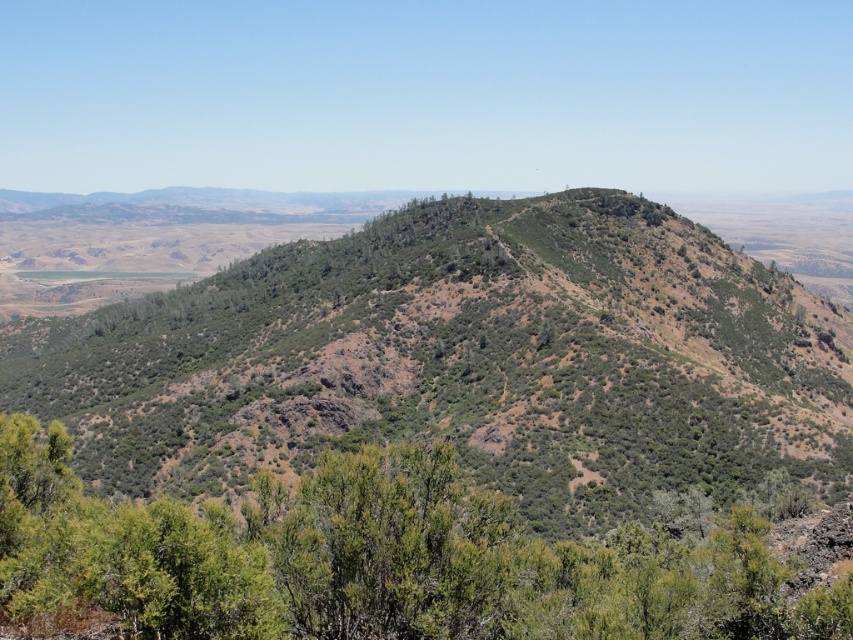
You are a hiker standing at the base of the hill and see the green shrubbery at center and the green leafy shrub at center. Which one is farther from you?

The green shrubbery at center is 207.67 feet from green leafy shrub at center, so the green shrubbery at center is farther away from you than the green leafy shrub at center.

You are a hiker trying to navigate through the dense green shrubbery at center and the green leafy shrub at center. Which one should you avoid to find a wider path?

You should avoid the green shrubbery at center because it is bigger than the green leafy shrub at center, so the latter offers a wider path.